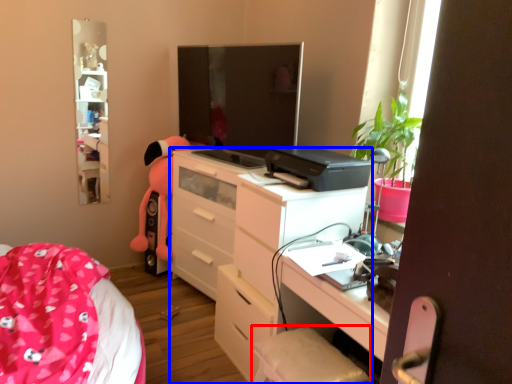
Question: Which object appears farthest to the camera in this image, swivel chair (highlighted by a red box) or chest of drawers (highlighted by a blue box)?

Choices:
 (A) swivel chair
 (B) chest of drawers

Answer: (B)